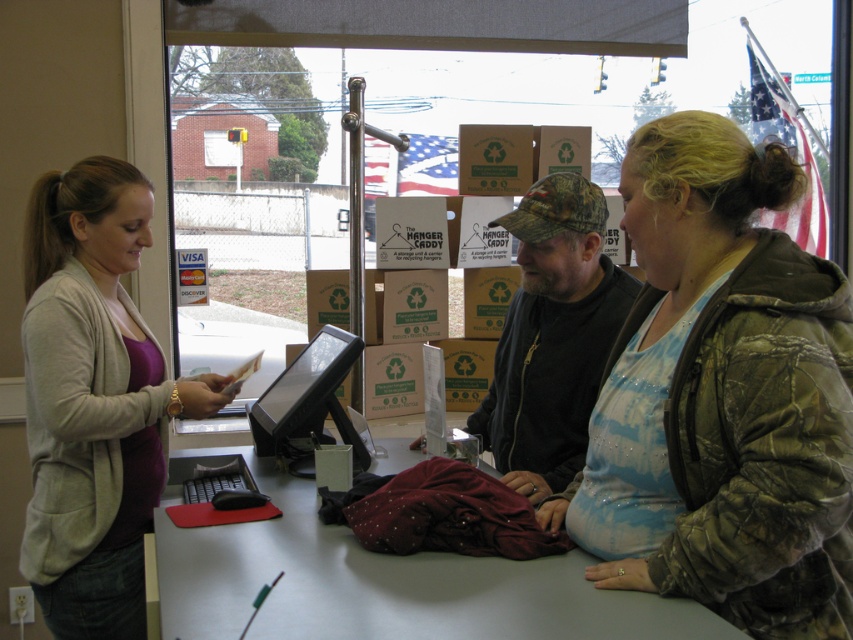
Question: Among these objects, which one is farthest from the camera?

Choices:
 (A) camo jacket at center
 (B) camouflage hat at center
 (C) light gray cardigan at left
 (D) white plastic table at center

Answer: (B)

Question: Can you confirm if camo jacket at center is thinner than light gray cardigan at left?

Choices:
 (A) no
 (B) yes

Answer: (B)

Question: Which of the following is the closest to the observer?

Choices:
 (A) light gray cardigan at left
 (B) camo jacket at center

Answer: (B)

Question: Does camo jacket at center come in front of light gray cardigan at left?

Choices:
 (A) yes
 (B) no

Answer: (A)

Question: Does camo jacket at center have a smaller size compared to camouflage hat at center?

Choices:
 (A) no
 (B) yes

Answer: (B)

Question: Which point appears closest to the camera in this image?

Choices:
 (A) (660, 621)
 (B) (32, 330)

Answer: (A)